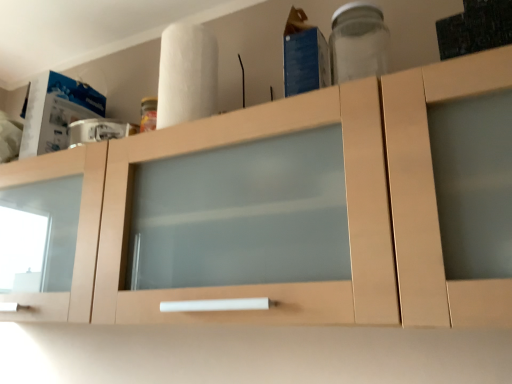
Question: Does white matte paper towel at upper center have a greater width compared to transparent glass jar at upper right?

Choices:
 (A) yes
 (B) no

Answer: (B)

Question: From the image's perspective, is white matte paper towel at upper center on top of transparent glass jar at upper right?

Choices:
 (A) yes
 (B) no

Answer: (B)

Question: From the image's perspective, does white matte paper towel at upper center appear lower than transparent glass jar at upper right?

Choices:
 (A) yes
 (B) no

Answer: (A)

Question: Does white matte paper towel at upper center have a smaller size compared to transparent glass jar at upper right?

Choices:
 (A) no
 (B) yes

Answer: (A)

Question: Is white matte paper towel at upper center facing towards transparent glass jar at upper right?

Choices:
 (A) yes
 (B) no

Answer: (B)

Question: In terms of width, does white matte paper towel at upper center look wider or thinner when compared to transparent glass jar at upper right?

Choices:
 (A) thin
 (B) wide

Answer: (A)

Question: Considering the relative positions of white matte paper towel at upper center and transparent glass jar at upper right in the image provided, is white matte paper towel at upper center to the left or to the right of transparent glass jar at upper right?

Choices:
 (A) right
 (B) left

Answer: (B)

Question: Is white matte paper towel at upper center spatially inside transparent glass jar at upper right, or outside of it?

Choices:
 (A) outside
 (B) inside

Answer: (A)

Question: From their relative heights in the image, would you say white matte paper towel at upper center is taller or shorter than transparent glass jar at upper right?

Choices:
 (A) tall
 (B) short

Answer: (A)

Question: From a real-world perspective, is transparent glass jar at upper right positioned above or below white matte paper towel at upper center?

Choices:
 (A) above
 (B) below

Answer: (B)

Question: Considering their positions, is transparent glass jar at upper right located in front of or behind white matte paper towel at upper center?

Choices:
 (A) front
 (B) behind

Answer: (A)

Question: From the image's perspective, is transparent glass jar at upper right located above or below white matte paper towel at upper center?

Choices:
 (A) below
 (B) above

Answer: (B)

Question: In the image, is transparent glass jar at upper right on the left side or the right side of white matte paper towel at upper center?

Choices:
 (A) right
 (B) left

Answer: (A)

Question: Based on their positions, is light wood cabinet at center located to the left or right of transparent glass jar at upper right?

Choices:
 (A) right
 (B) left

Answer: (B)

Question: Is light wood cabinet at center bigger or smaller than transparent glass jar at upper right?

Choices:
 (A) big
 (B) small

Answer: (A)